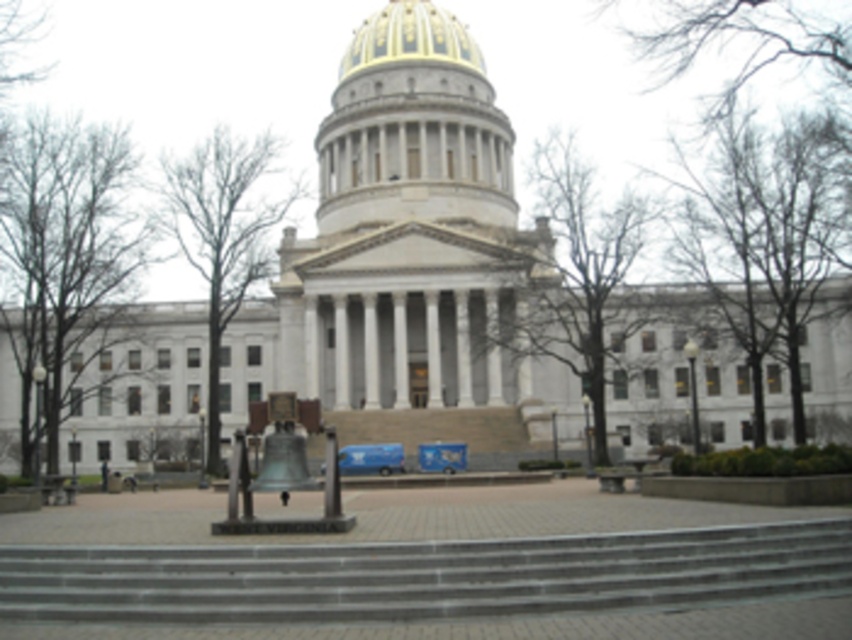
You are a landscape architect designing a pathway between the bare branches at center and the green leafless tree at center. Given that the minimum required distance between such trees for a walking path is 30 meters, will the existing spacing allow for compliance with this requirement?

The distance between the bare branches at center and the green leafless tree at center is 28.49 meters, which is less than the required 30 meters. Therefore, the existing spacing does not comply with the requirement.